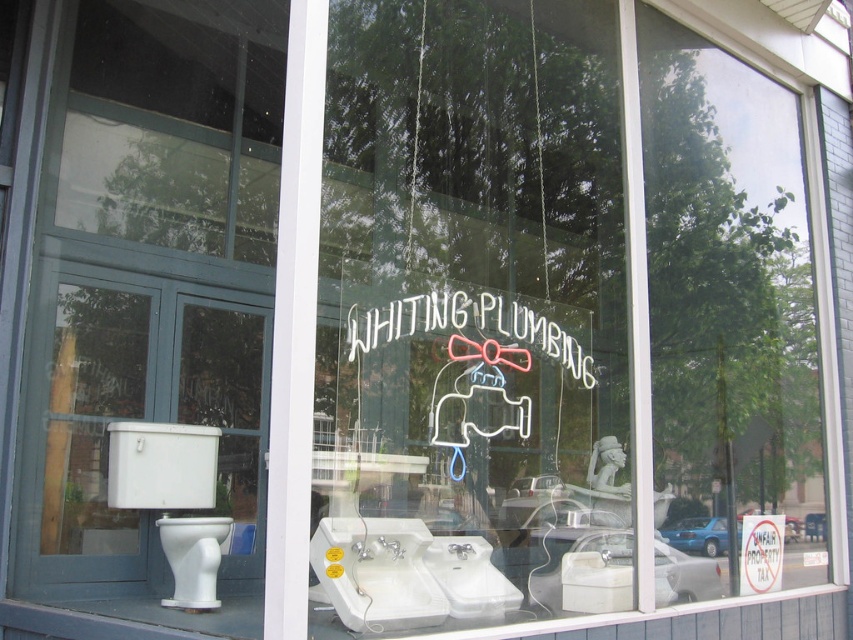
Question: Is neon sign at center below white glossy toilet bowl at lower left?

Choices:
 (A) yes
 (B) no

Answer: (B)

Question: Which object appears farthest from the camera in this image?

Choices:
 (A) white glossy toilet at left
 (B) white glossy toilet at lower left
 (C) white paper sign at center

Answer: (C)

Question: Does white glossy toilet at lower left appear under white paper sign at center?

Choices:
 (A) no
 (B) yes

Answer: (A)

Question: Considering the real-world distances, which object is closest to the white glossy toilet at left?

Choices:
 (A) white paper sign at center
 (B) neon sign at center

Answer: (B)

Question: Does neon sign at center have a greater width compared to white paper sign at center?

Choices:
 (A) yes
 (B) no

Answer: (A)

Question: Which point is closer to the camera?

Choices:
 (A) white glossy toilet bowl at lower left
 (B) white paper sign at center

Answer: (A)